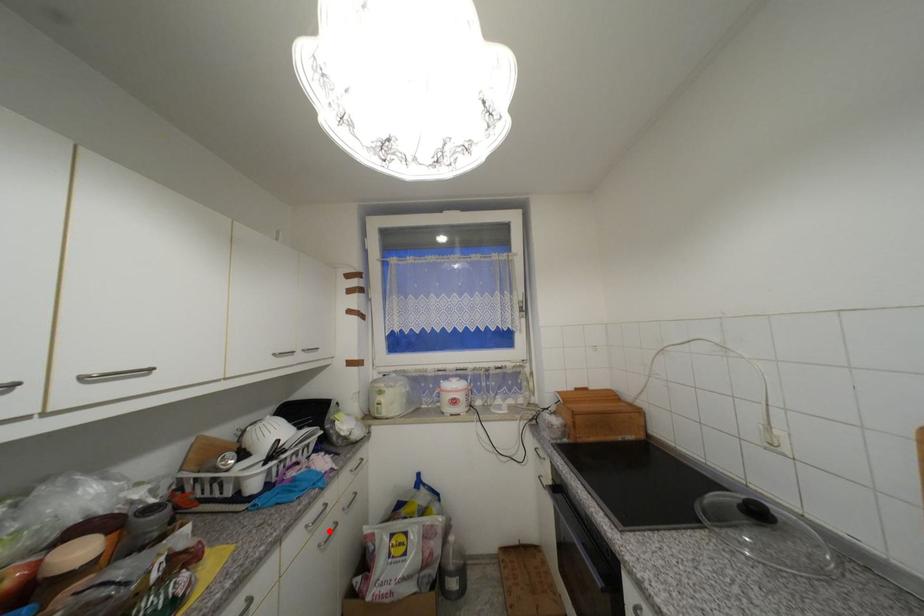
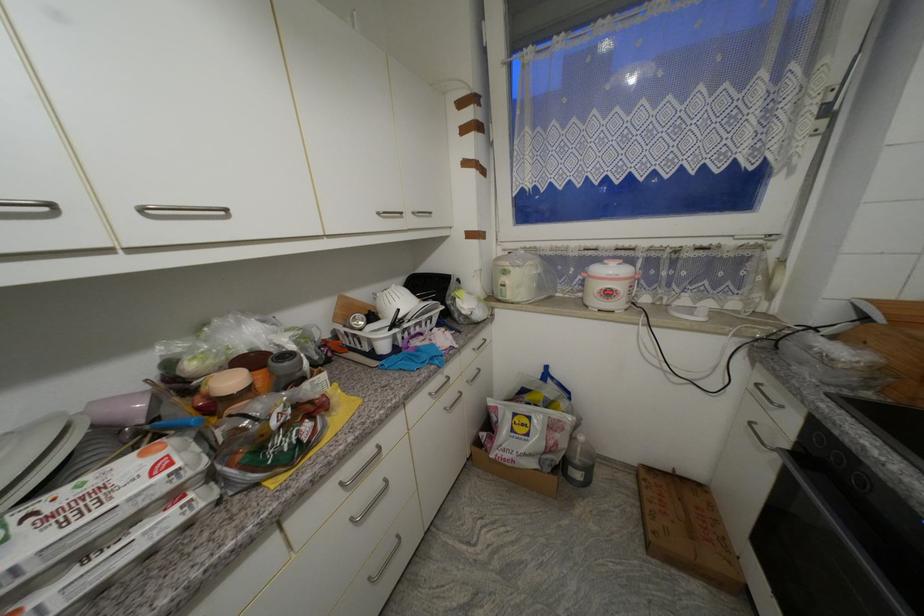
Find the pixel in the second image that matches the highlighted location in the first image.

(455, 398)